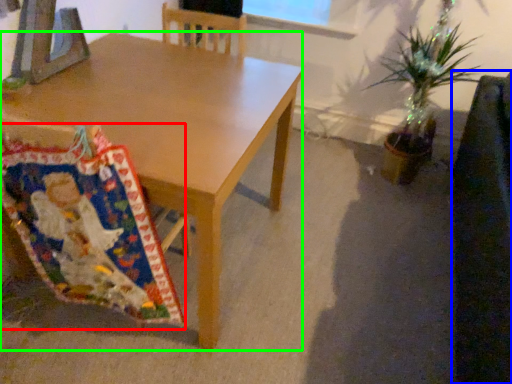
Question: Which object is positioned farthest from blanket (highlighted by a red box)? Select from swivel chair (highlighted by a blue box) and desk (highlighted by a green box).

Choices:
 (A) swivel chair
 (B) desk

Answer: (A)